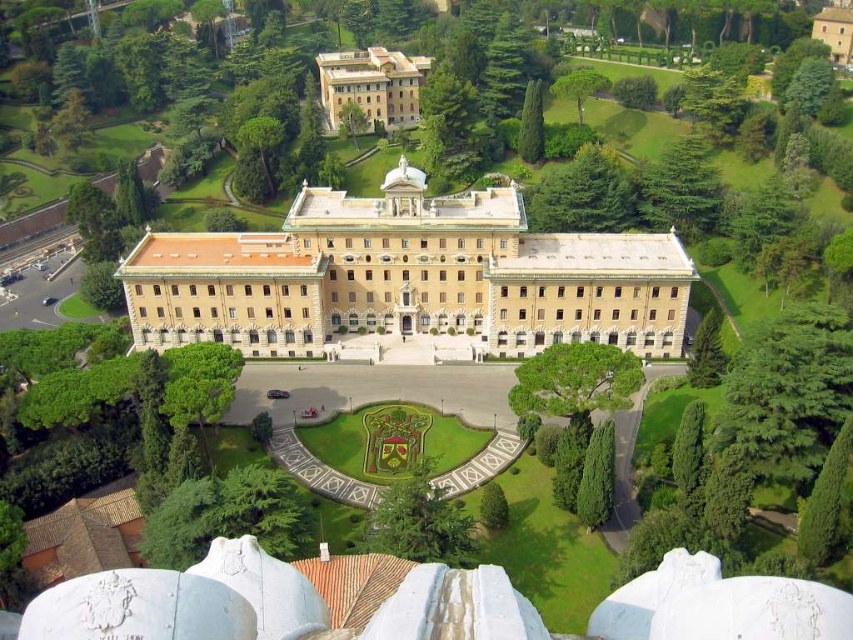
Question: Which point is farther from the camera taking this photo?

Choices:
 (A) (461, 330)
 (B) (373, 108)

Answer: (B)

Question: Is beige stone building at center positioned before beige stone building at upper center?

Choices:
 (A) yes
 (B) no

Answer: (A)

Question: Among these points, which one is farthest from the camera?

Choices:
 (A) (582, 282)
 (B) (323, 74)

Answer: (B)

Question: Does beige stone building at center have a smaller size compared to beige stone building at upper center?

Choices:
 (A) yes
 (B) no

Answer: (B)

Question: Is beige stone building at center bigger than beige stone building at upper center?

Choices:
 (A) no
 (B) yes

Answer: (B)